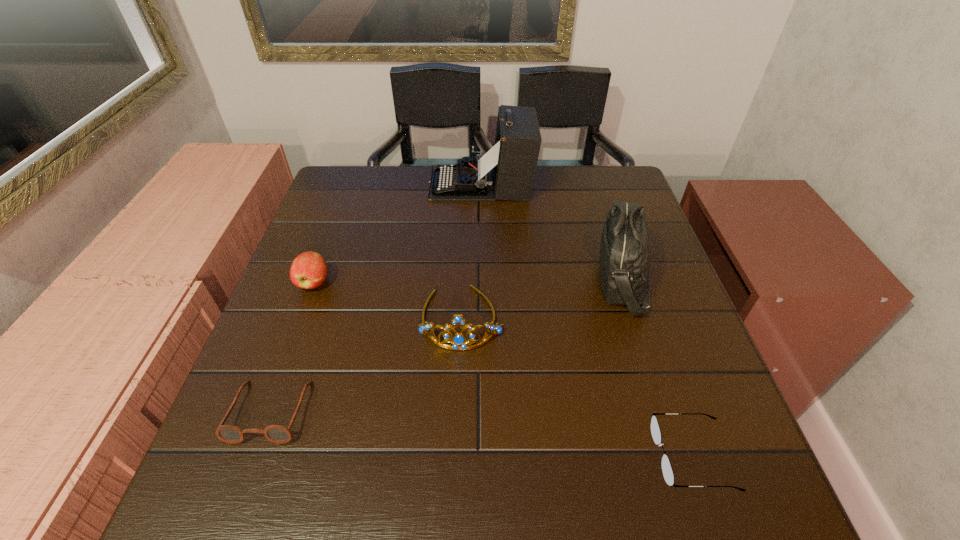
Image resolution: width=960 pixels, height=540 pixels. Identify the location of typewriter. (506, 172).

Locate an element on the screen. shoulder bag is located at coordinates (625, 245).

Locate an element on the screen. tiara is located at coordinates (459, 341).

Identify the location of apple. (308, 270).

Identify the location of the left spectacles. (279, 434).

What are the coordinates of `the shorter spectacles` in the screenshot? It's located at (667, 471).

This screenshot has width=960, height=540. Find the location of `the shortest object`. the shortest object is located at coordinates (667, 471).

The width and height of the screenshot is (960, 540). Identify the location of vacant space located inside the open case of the typewriter. (338, 184).

This screenshot has height=540, width=960. I want to click on free location located 0.280m inside the open case of the typewriter, so click(338, 184).

Find the location of a particular element. vacant space located inside the open case of the typewriter is located at coordinates (384, 184).